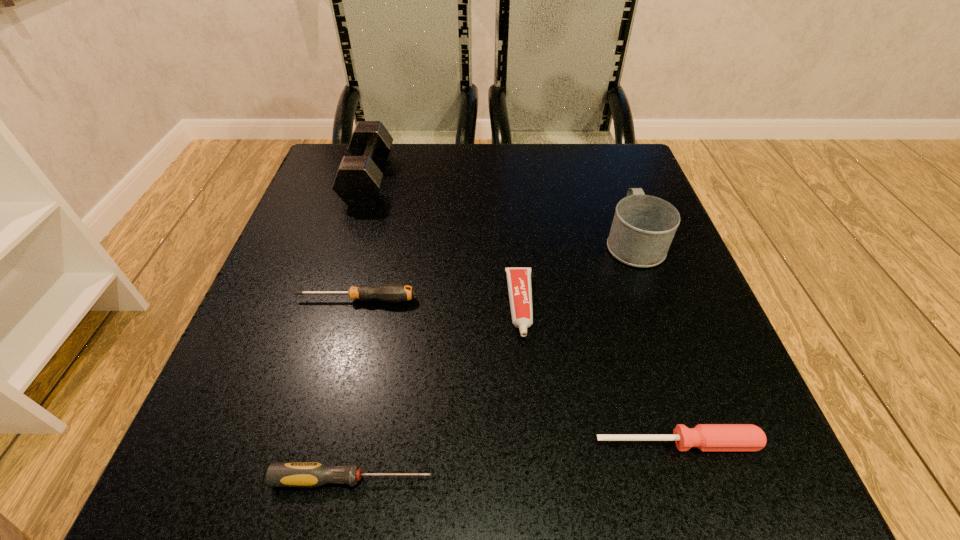
At what (x,y) coordinates should I click in order to perform the action: click on object situated at the near left corner. Please return your answer as a coordinate pair (x, y). The image size is (960, 540). Looking at the image, I should click on (279, 474).

Image resolution: width=960 pixels, height=540 pixels. What are the coordinates of `object that is positioned at the near right corner` in the screenshot? It's located at (707, 437).

Locate an element on the screen. vacant space at the far edge of the desktop is located at coordinates (482, 184).

This screenshot has height=540, width=960. In the image, there is a desktop. Find the location of `vacant area at the near edge`. vacant area at the near edge is located at coordinates (462, 434).

Image resolution: width=960 pixels, height=540 pixels. I want to click on free space at the left edge of the desktop, so click(290, 325).

In the image, there is a desktop. Where is `vacant space at the far right corner`? Image resolution: width=960 pixels, height=540 pixels. vacant space at the far right corner is located at coordinates (580, 173).

The height and width of the screenshot is (540, 960). Identify the location of empty space that is in between the farthest screwdriver and the third object from right to left. (438, 302).

The height and width of the screenshot is (540, 960). Identify the location of free point between the dumbbell and the farthest screwdriver. (362, 240).

Find the location of a particular element. This screenshot has width=960, height=540. empty location between the fifth nearest object and the toothpaste is located at coordinates (577, 273).

Where is `vacant area between the fifth nearest object and the second nearest screwdriver`? vacant area between the fifth nearest object and the second nearest screwdriver is located at coordinates (656, 342).